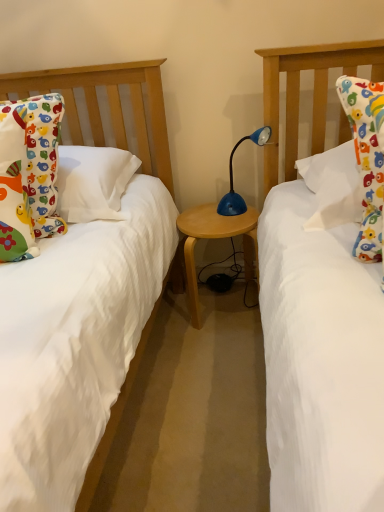
Question: Is blue plastic lamp at center bigger or smaller than matte cotton pillow at left?

Choices:
 (A) small
 (B) big

Answer: (A)

Question: Is blue plastic lamp at center inside or outside of matte cotton pillow at left?

Choices:
 (A) outside
 (B) inside

Answer: (A)

Question: Considering the real-world distances, which object is closest to the blue plastic lamp at center?

Choices:
 (A) wooden table at center
 (B) matte cotton pillow at left

Answer: (A)

Question: Estimate the real-world distances between objects in this image. Which object is farther from the blue plastic lamp at center?

Choices:
 (A) wooden table at center
 (B) matte cotton pillow at left

Answer: (B)